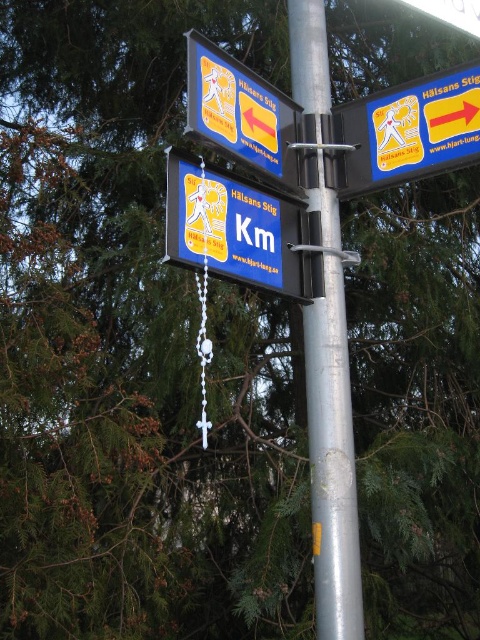
From the picture: Who is shorter, blue plastic sign at center or blue plastic sign at upper right?

blue plastic sign at upper right is shorter.

Is the position of blue plastic sign at center more distant than that of blue plastic sign at upper right?

No, blue plastic sign at center is closer to the viewer.

Is point (179, 244) more distant than point (344, 176)?

That is False.

At what (x,y) coordinates should I click in order to perform the action: click on blue plastic sign at center. Please return your answer as a coordinate pair (x, y). The height and width of the screenshot is (640, 480). Looking at the image, I should click on (233, 228).

Between silver metallic pole at center and blue plastic sign at center, which one has less height?

blue plastic sign at center is shorter.

Which is in front, point (320, 193) or point (223, 250)?

Point (223, 250) is more forward.

Where is `silver metallic pole at center`? The width and height of the screenshot is (480, 640). silver metallic pole at center is located at coordinates (332, 461).

Measure the distance between silver metallic pole at center and blue plastic sign at upper right.

silver metallic pole at center and blue plastic sign at upper right are 8.98 inches apart.

Is point (291, 77) more distant than point (349, 112)?

Yes, it is behind point (349, 112).

Identify the location of silver metallic pole at center. (332, 461).